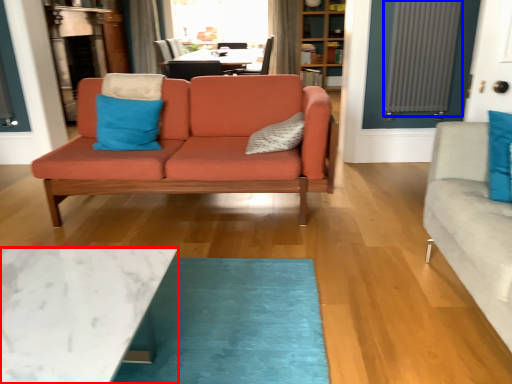
Question: Which object appears farthest to the camera in this image, coffee table (highlighted by a red box) or radiator (highlighted by a blue box)?

Choices:
 (A) coffee table
 (B) radiator

Answer: (B)